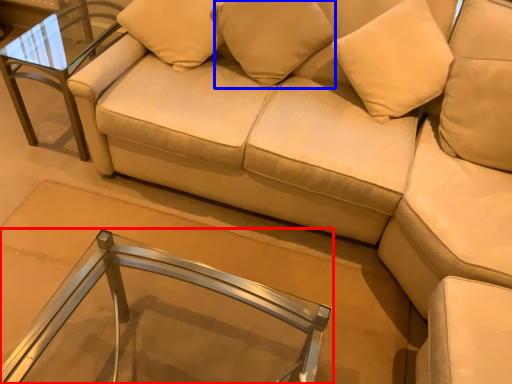
Question: Which object is further to the camera taking this photo, table (highlighted by a red box) or pillow (highlighted by a blue box)?

Choices:
 (A) table
 (B) pillow

Answer: (B)